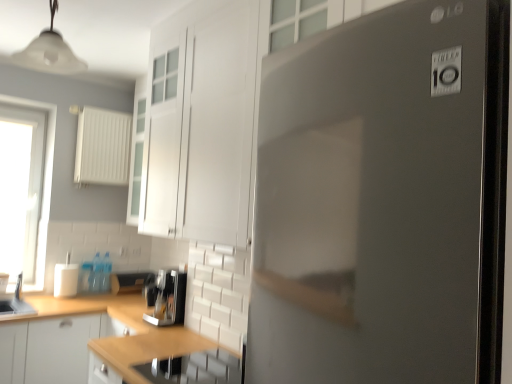
The height and width of the screenshot is (384, 512). In order to click on transparent glass window at left in this screenshot , I will do `click(21, 192)`.

Image resolution: width=512 pixels, height=384 pixels. I want to click on sleek metallic coffee maker at center, so click(166, 297).

At what (x,y) coordinates should I click in order to perform the action: click on white glossy cup at lower left, which ranks as the second appliance in top-to-bottom order. Please return your answer as a coordinate pair (x, y). Looking at the image, I should click on (66, 278).

At what (x,y) coordinates should I click in order to perform the action: click on transparent glass window at left. Please return your answer as a coordinate pair (x, y). The height and width of the screenshot is (384, 512). Looking at the image, I should click on (21, 192).

From a real-world perspective, is wooden countertop at lower center positioned under white plastic radiator at upper left, acting as the third appliance starting from the bottom, based on gravity?

Yes, from a real-world perspective, wooden countertop at lower center is beneath white plastic radiator at upper left, acting as the third appliance starting from the bottom.

Considering the relative sizes of wooden countertop at lower center and white plastic radiator at upper left, which appears as the second appliance when viewed from the left, in the image provided, is wooden countertop at lower center smaller than white plastic radiator at upper left, which appears as the second appliance when viewed from the left,?

Actually, wooden countertop at lower center might be larger than white plastic radiator at upper left, which appears as the second appliance when viewed from the left.

Is white plastic radiator at upper left, the 1th appliance viewed from the back, completely or partially inside wooden countertop at lower center?

No, wooden countertop at lower center does not contain white plastic radiator at upper left, the 1th appliance viewed from the back.

Considering the points (148, 344) and (121, 157), which point is in front, point (148, 344) or point (121, 157)?

Point (148, 344)

From the image's perspective, which one is positioned lower, satin black fridge at center or white plastic radiator at upper left, acting as the third appliance starting from the bottom?

From the image's view, satin black fridge at center is below.

Is satin black fridge at center inside the boundaries of white plastic radiator at upper left, which is the first appliance from top to bottom, or outside?

→ satin black fridge at center exists outside the volume of white plastic radiator at upper left, which is the first appliance from top to bottom.

Is satin black fridge at center directly adjacent to white plastic radiator at upper left, which is the 2th appliance from right to left?

satin black fridge at center and white plastic radiator at upper left, which is the 2th appliance from right to left, are clearly separated.

Is satin black fridge at center thinner than white plastic radiator at upper left, which appears as the second appliance when viewed from the left?

In fact, satin black fridge at center might be wider than white plastic radiator at upper left, which appears as the second appliance when viewed from the left.

Which object is further away from the camera, transparent glass window at left or wooden countertop at lower center?

transparent glass window at left is behind.

Which of these two, transparent glass window at left or wooden countertop at lower center, is wider?

wooden countertop at lower center.

Is white matte cabinet at lower left, positioned as the 1th cabinetry in bottom-to-top order, taller than white glossy cabinet at upper center, placed as the first cabinetry when sorted from right to left?

In fact, white matte cabinet at lower left, positioned as the 1th cabinetry in bottom-to-top order, may be shorter than white glossy cabinet at upper center, placed as the first cabinetry when sorted from right to left.

Would you say white matte cabinet at lower left, positioned as the 1th cabinetry in bottom-to-top order, is outside white glossy cabinet at upper center, marked as the 2th cabinetry in a back-to-front arrangement?

That's correct, white matte cabinet at lower left, positioned as the 1th cabinetry in bottom-to-top order, is outside of white glossy cabinet at upper center, marked as the 2th cabinetry in a back-to-front arrangement.

From a real-world perspective, is white matte cabinet at lower left, positioned as the 1th cabinetry in bottom-to-top order, over white glossy cabinet at upper center, placed as the second cabinetry when sorted from left to right?

Incorrect, from a real-world perspective, white matte cabinet at lower left, positioned as the 1th cabinetry in bottom-to-top order, is lower than white glossy cabinet at upper center, placed as the second cabinetry when sorted from left to right.

From a real-world perspective, is white plastic radiator at upper left, which is the 3th appliance from front to back, positioned under transparent glass window at left based on gravity?

No, from a real-world perspective, white plastic radiator at upper left, which is the 3th appliance from front to back, is not under transparent glass window at left.

From the image's perspective, which one is positioned lower, white plastic radiator at upper left, which is the first appliance from top to bottom, or transparent glass window at left?

transparent glass window at left, from the image's perspective.

Is white plastic radiator at upper left, which is the 2th appliance from right to left, taller than transparent glass window at left?

In fact, white plastic radiator at upper left, which is the 2th appliance from right to left, may be shorter than transparent glass window at left.

Between sleek metallic coffee maker at center and satin black fridge at center, which one has smaller width?

With smaller width is sleek metallic coffee maker at center.

From a real-world perspective, between sleek metallic coffee maker at center and satin black fridge at center, who is vertically higher?

In real-world perspective, satin black fridge at center is above.

Is point (166, 271) closer to viewer compared to point (341, 303)?

That is False.

In the scene shown: Is satin black fridge at center at the back of sleek metallic coffee maker at center?

sleek metallic coffee maker at center is not turned away from satin black fridge at center.

Is white plastic radiator at upper left, which is the 3th appliance from front to back, wider or thinner than white glossy cup at lower left, which is the 3th appliance from right to left?

Considering their sizes, white plastic radiator at upper left, which is the 3th appliance from front to back, looks slimmer than white glossy cup at lower left, which is the 3th appliance from right to left.

From a real-world perspective, which is physically below, white plastic radiator at upper left, which appears as the second appliance when viewed from the left, or white glossy cup at lower left, the second appliance from the bottom?

From a 3D spatial view, white glossy cup at lower left, the second appliance from the bottom, is below.

Who is taller, white plastic radiator at upper left, which is the 2th appliance from right to left, or white glossy cup at lower left, which ranks as the second appliance in top-to-bottom order?

white plastic radiator at upper left, which is the 2th appliance from right to left, is taller.

Locate an element on the screen. The height and width of the screenshot is (384, 512). countertop on the right of the white plastic radiator at upper left, which is the first appliance from top to bottom is located at coordinates (153, 355).

You are a GUI agent. You are given a task and a screenshot of the screen. Output one action in this format:
    pyautogui.click(x=<x>, y=<y>)
    Task: Click on the appliance above the satin black fridge at center (from the image's perspective)
    This screenshot has height=384, width=512.
    Given the screenshot: What is the action you would take?
    pyautogui.click(x=102, y=147)

Looking at this image, considering their positions, is white glossy cup at lower left, the second appliance from the bottom, positioned further to stainless steel sink at lower center, which is the first appliance from bottom to top, than white glossy cabinet at upper center, placed as the second cabinetry when sorted from left to right?

The object further to stainless steel sink at lower center, which is the first appliance from bottom to top, is white glossy cup at lower left, the second appliance from the bottom.

From the picture: Considering their positions, is white matte cabinet at lower left, which ranks as the 2th cabinetry in top-to-bottom order, positioned closer to transparent glass window at left than stainless steel sink at lower center, which is the first appliance from bottom to top?

Based on the image, white matte cabinet at lower left, which ranks as the 2th cabinetry in top-to-bottom order, appears to be nearer to transparent glass window at left.

From the image, which object appears to be farther from transparent glass window at left, wooden countertop at lower center or white matte cabinet at lower left, which ranks as the 2th cabinetry in top-to-bottom order?

wooden countertop at lower center.

When comparing their distances from white plastic radiator at upper left, which is the first appliance from top to bottom, does sleek metallic coffee maker at center or stainless steel sink at lower center, acting as the 3th appliance starting from the back, seem closer?

Among the two, sleek metallic coffee maker at center is located nearer to white plastic radiator at upper left, which is the first appliance from top to bottom.

Estimate the real-world distances between objects in this image. Which object is further from white glossy cup at lower left, which appears as the first appliance when viewed from the left, stainless steel sink at lower center, marked as the third appliance in a top-to-bottom arrangement, or transparent glass window at left?

stainless steel sink at lower center, marked as the third appliance in a top-to-bottom arrangement, is positioned further to the anchor white glossy cup at lower left, which appears as the first appliance when viewed from the left.

Which object lies nearer to the anchor point transparent glass window at left, stainless steel sink at lower center, acting as the 3th appliance starting from the back, or satin black fridge at center?

Based on the image, stainless steel sink at lower center, acting as the 3th appliance starting from the back, appears to be nearer to transparent glass window at left.

Looking at the image, which one is located further to white plastic radiator at upper left, which is the first appliance from top to bottom, satin black fridge at center or transparent glass window at left?

satin black fridge at center is positioned further to the anchor white plastic radiator at upper left, which is the first appliance from top to bottom.

Estimate the real-world distances between objects in this image. Which object is further from sleek metallic coffee maker at center, white glossy cabinet at upper center, the 1th cabinetry viewed from the top, or transparent glass window at left?

The object further to sleek metallic coffee maker at center is transparent glass window at left.

This screenshot has width=512, height=384. In order to click on appliance between white glossy cabinet at upper center, placed as the second cabinetry when sorted from left to right, and white glossy cup at lower left, which is counted as the second appliance, starting from the back, from front to back in this screenshot , I will do `click(194, 369)`.

This screenshot has height=384, width=512. What are the coordinates of `countertop positioned between satin black fridge at center and white glossy cup at lower left, which appears as the first appliance when viewed from the left, from near to far` in the screenshot? It's located at (153, 355).

The width and height of the screenshot is (512, 384). I want to click on countertop between satin black fridge at center and white plastic radiator at upper left, which is the 2th appliance from right to left, along the z-axis, so click(153, 355).

Identify the location of home appliance positioned between stainless steel sink at lower center, placed as the 1th appliance when sorted from front to back, and white matte cabinet at lower left, marked as the second cabinetry in a front-to-back arrangement, from near to far. The height and width of the screenshot is (384, 512). (166, 297).